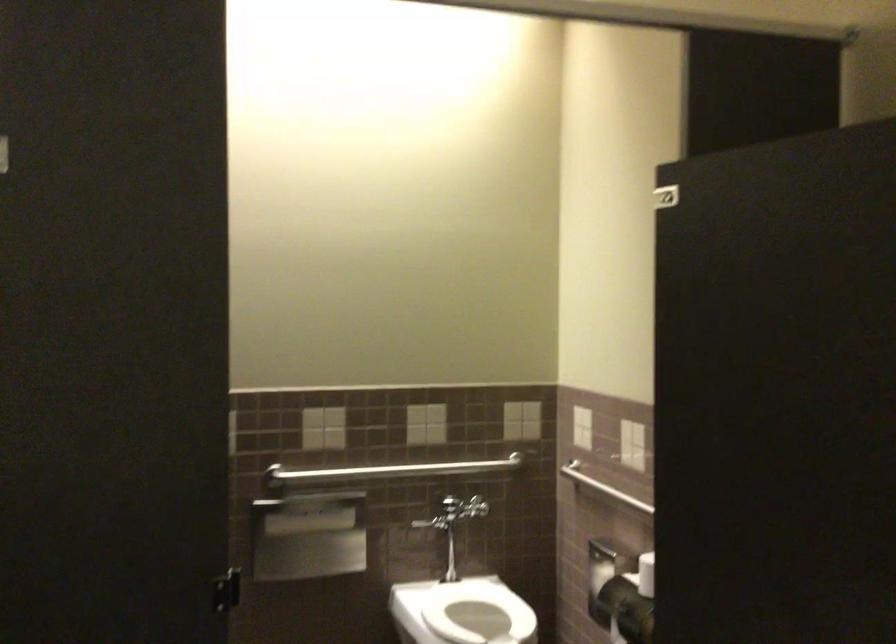
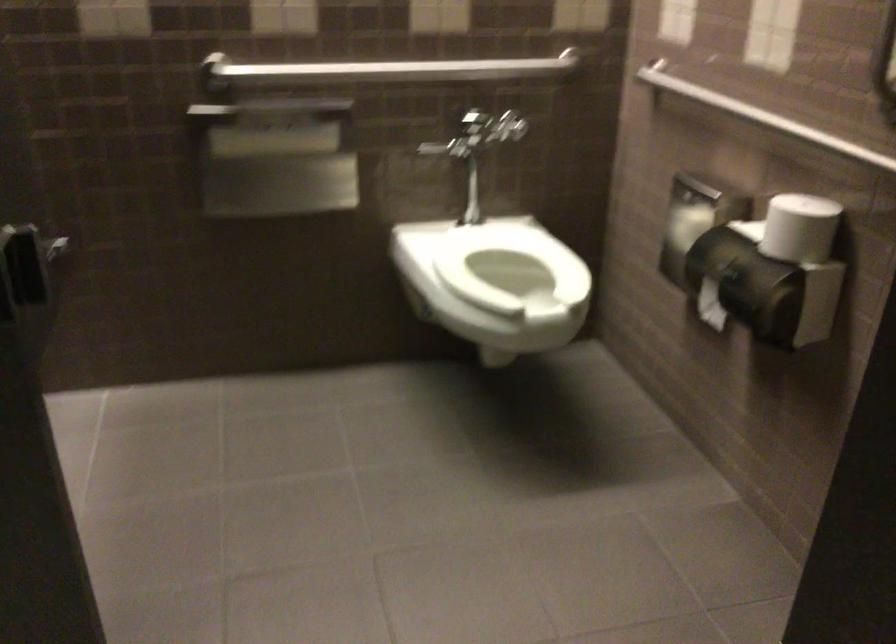
Find the pixel in the second image that matches (306,522) in the first image.

(273, 143)